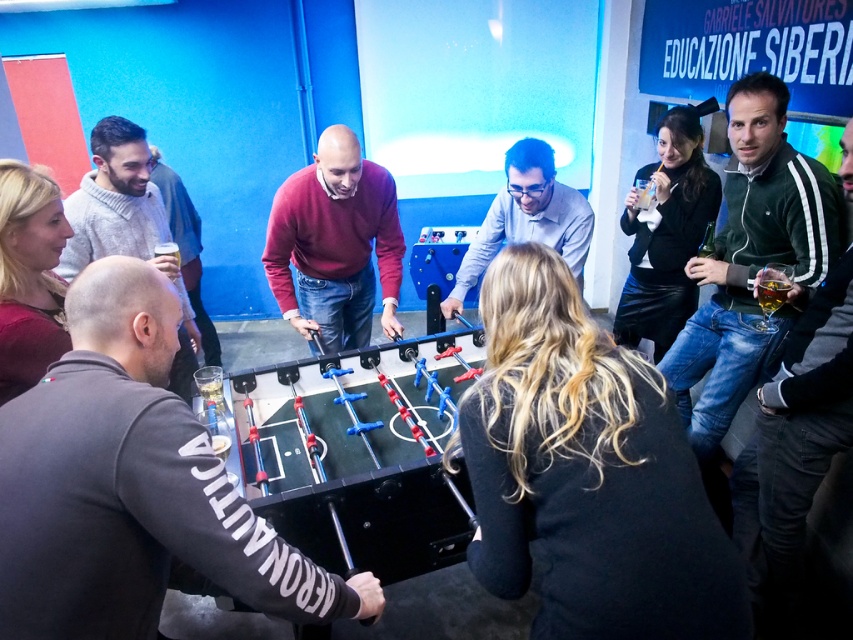
Can you confirm if matte gray shirt at center is thinner than translucent glass at upper center?

In fact, matte gray shirt at center might be wider than translucent glass at upper center.

Can you confirm if matte gray shirt at center is smaller than translucent glass at upper center?

No.

Which is behind, point (520, 208) or point (637, 200)?

The point (637, 200) is more distant.

Where is `matte gray shirt at center`? The image size is (853, 640). matte gray shirt at center is located at coordinates (527, 218).

Find the location of a particular element. Image resolution: width=853 pixels, height=640 pixels. gray sweater at center is located at coordinates (126, 225).

Which is more to the right, gray sweater at center or dark gray sweater at lower left?

Positioned to the right is gray sweater at center.

Who is more forward, (138, 168) or (177, 211)?

Point (138, 168) is in front.

At what (x,y) coordinates should I click in order to perform the action: click on gray sweater at center. Please return your answer as a coordinate pair (x, y). The image size is (853, 640). Looking at the image, I should click on (126, 225).

Which is above, dark gray sweatshirt at center or maroon sweater at center?

maroon sweater at center is higher up.

This screenshot has height=640, width=853. I want to click on dark gray sweatshirt at center, so click(131, 484).